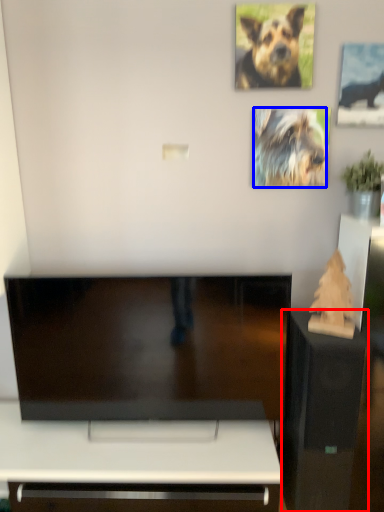
Question: Which object appears closest to the camera in this image, furniture (highlighted by a red box) or dog (highlighted by a blue box)?

Choices:
 (A) furniture
 (B) dog

Answer: (A)